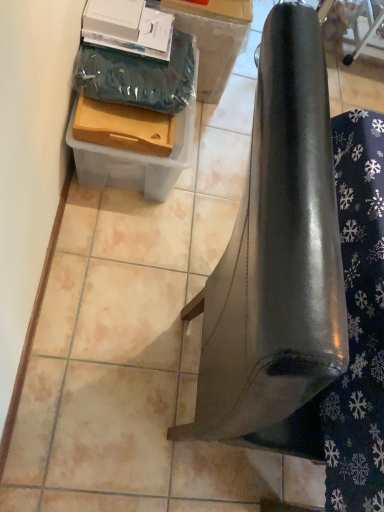
Question: Are matte plastic box at upper left, the second cardboard box viewed from the top, and cardboard box at upper left, positioned as the second cardboard box in bottom-to-top order, located far from each other?

Choices:
 (A) no
 (B) yes

Answer: (A)

Question: Is matte plastic box at upper left, the first cardboard box from the bottom, next to cardboard box at upper left, positioned as the second cardboard box in bottom-to-top order?

Choices:
 (A) yes
 (B) no

Answer: (B)

Question: Is matte plastic box at upper left, the second cardboard box viewed from the top, in front of cardboard box at upper left, the first cardboard box in the top-to-bottom sequence?

Choices:
 (A) no
 (B) yes

Answer: (B)

Question: Can you confirm if matte plastic box at upper left, the second cardboard box viewed from the top, is positioned to the right of cardboard box at upper left, positioned as the second cardboard box in bottom-to-top order?

Choices:
 (A) no
 (B) yes

Answer: (A)

Question: Would you say matte plastic box at upper left, the first cardboard box from the bottom, is outside cardboard box at upper left, positioned as the second cardboard box in bottom-to-top order?

Choices:
 (A) no
 (B) yes

Answer: (B)

Question: Considering the positions of glossy metallic punching bag at right and wooden drawer at upper left in the image, is glossy metallic punching bag at right bigger or smaller than wooden drawer at upper left?

Choices:
 (A) small
 (B) big

Answer: (B)

Question: Considering the positions of glossy metallic punching bag at right and wooden drawer at upper left in the image, is glossy metallic punching bag at right taller or shorter than wooden drawer at upper left?

Choices:
 (A) tall
 (B) short

Answer: (A)

Question: From the image's perspective, is glossy metallic punching bag at right positioned above or below wooden drawer at upper left?

Choices:
 (A) below
 (B) above

Answer: (A)

Question: Considering their positions, is glossy metallic punching bag at right located in front of or behind wooden drawer at upper left?

Choices:
 (A) front
 (B) behind

Answer: (A)

Question: Is wooden drawer at upper left to the left or to the right of matte plastic box at upper left, the second cardboard box viewed from the top, in the image?

Choices:
 (A) left
 (B) right

Answer: (B)

Question: Based on their sizes in the image, would you say wooden drawer at upper left is bigger or smaller than matte plastic box at upper left, the second cardboard box viewed from the top?

Choices:
 (A) small
 (B) big

Answer: (A)

Question: From a real-world perspective, is wooden drawer at upper left physically located above or below matte plastic box at upper left, the first cardboard box from the bottom?

Choices:
 (A) below
 (B) above

Answer: (B)

Question: Is wooden drawer at upper left in front of or behind matte plastic box at upper left, the first cardboard box from the bottom, in the image?

Choices:
 (A) front
 (B) behind

Answer: (A)

Question: Considering the relative positions of cardboard box at upper left, the first cardboard box in the top-to-bottom sequence, and matte plastic box at upper left, the first cardboard box from the bottom, in the image provided, is cardboard box at upper left, the first cardboard box in the top-to-bottom sequence, to the left or to the right of matte plastic box at upper left, the first cardboard box from the bottom,?

Choices:
 (A) right
 (B) left

Answer: (A)

Question: From a real-world perspective, relative to matte plastic box at upper left, the first cardboard box from the bottom, is cardboard box at upper left, positioned as the second cardboard box in bottom-to-top order, vertically above or below?

Choices:
 (A) below
 (B) above

Answer: (B)